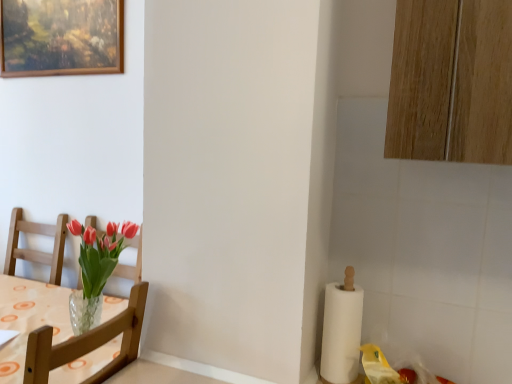
Question: Does wooden-framed painting at upper left lie behind wooden chair at left?

Choices:
 (A) yes
 (B) no

Answer: (A)

Question: Is wooden chair at left at the back of wooden-framed painting at upper left?

Choices:
 (A) yes
 (B) no

Answer: (B)

Question: Considering the relative positions of wooden-framed painting at upper left and wooden chair at left in the image provided, is wooden-framed painting at upper left to the left of wooden chair at left from the viewer's perspective?

Choices:
 (A) yes
 (B) no

Answer: (A)

Question: From the image's perspective, is wooden-framed painting at upper left on wooden chair at left?

Choices:
 (A) no
 (B) yes

Answer: (B)

Question: Can we say wooden-framed painting at upper left lies outside wooden chair at left?

Choices:
 (A) no
 (B) yes

Answer: (B)

Question: Is white paper at right in front of or behind wooden chair at left in the image?

Choices:
 (A) behind
 (B) front

Answer: (A)

Question: Is white paper at right situated inside wooden chair at left or outside?

Choices:
 (A) inside
 (B) outside

Answer: (B)

Question: From a real-world perspective, is white paper at right above or below wooden chair at left?

Choices:
 (A) below
 (B) above

Answer: (B)

Question: From the image's perspective, is white paper at right above or below wooden chair at left?

Choices:
 (A) above
 (B) below

Answer: (A)

Question: Is wooden chair at left to the left or to the right of wooden-framed painting at upper left in the image?

Choices:
 (A) left
 (B) right

Answer: (B)

Question: Considering their positions, is wooden chair at left located in front of or behind wooden-framed painting at upper left?

Choices:
 (A) behind
 (B) front

Answer: (B)

Question: Which is correct: wooden chair at left is inside wooden-framed painting at upper left, or outside of it?

Choices:
 (A) outside
 (B) inside

Answer: (A)

Question: From a real-world perspective, is wooden chair at left above or below wooden-framed painting at upper left?

Choices:
 (A) below
 (B) above

Answer: (A)

Question: Does point (64, 345) appear closer or farther from the camera than point (348, 299)?

Choices:
 (A) farther
 (B) closer

Answer: (B)

Question: Is wooden chair at left bigger or smaller than white paper at right?

Choices:
 (A) big
 (B) small

Answer: (A)